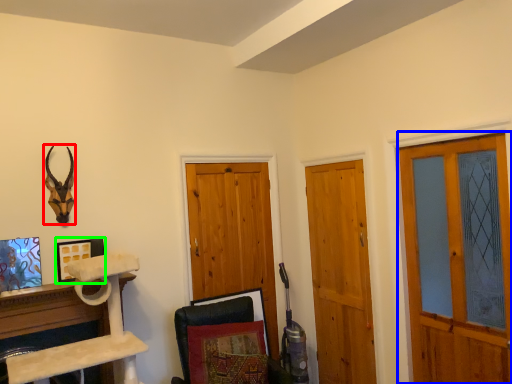
Question: Which object is the farthest from animal (highlighted by a red box)? Choose among these: screen door (highlighted by a blue box) or picture frame (highlighted by a green box).

Choices:
 (A) screen door
 (B) picture frame

Answer: (A)